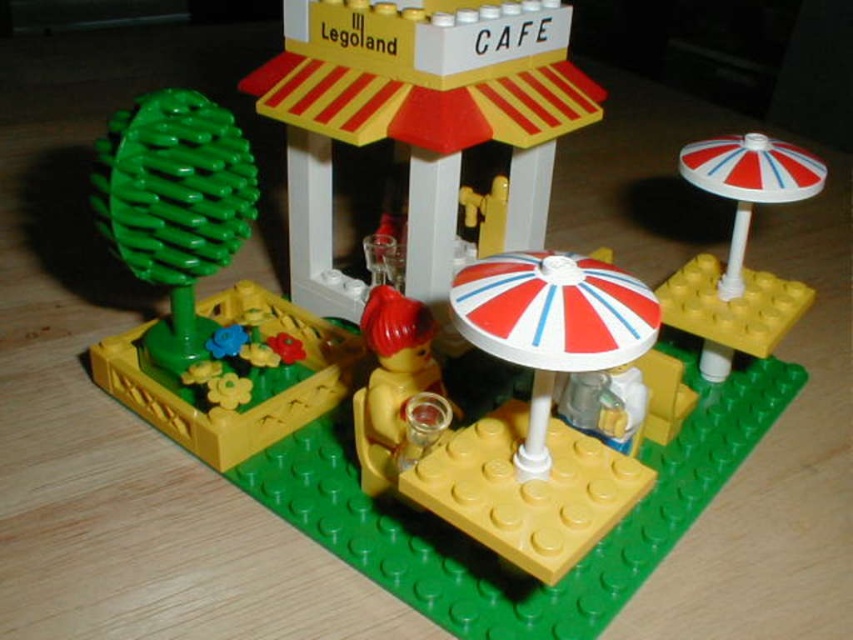
Which of these two, white plastic building at center or smooth yellow cup at center, stands shorter?

With less height is smooth yellow cup at center.

Who is more forward, (312, 93) or (376, 349)?

Point (376, 349) is more forward.

Image resolution: width=853 pixels, height=640 pixels. I want to click on white plastic building at center, so click(x=418, y=120).

Consider the image. Who is more forward, (517,88) or (785,186)?

Point (517,88) is in front.

Does white plastic building at center come in front of white striped umbrella at upper right?

That is True.

Is point (351, 68) less distant than point (776, 189)?

Yes, it is.

This screenshot has height=640, width=853. I want to click on white plastic building at center, so click(x=418, y=120).

Is white plastic building at center positioned in front of white striped umbrella at center?

That is False.

Is point (547, 60) in front of point (532, 388)?

No, it is behind (532, 388).

Image resolution: width=853 pixels, height=640 pixels. I want to click on white plastic building at center, so click(x=418, y=120).